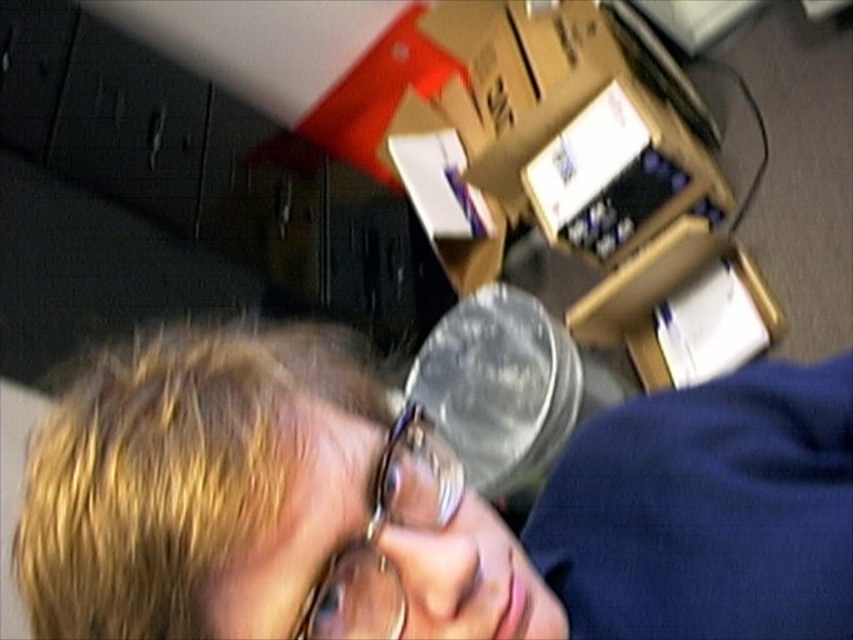
Is blonde hair at center shorter than gold-rimmed glasses at center?

Incorrect, blonde hair at center's height does not fall short of gold-rimmed glasses at center's.

Does blonde hair at center appear over gold-rimmed glasses at center?

Incorrect, blonde hair at center is not positioned above gold-rimmed glasses at center.

Between point (115, 378) and point (311, 636), which one is positioned in front?

Positioned in front is point (311, 636).

Find the location of a particular element. This screenshot has height=640, width=853. blonde hair at center is located at coordinates (171, 470).

Does clear plastic cup at center appear over blonde hair at center?

Yes.

Between clear plastic cup at center and blonde hair at center, which one has less height?

Standing shorter between the two is clear plastic cup at center.

Who is more forward, (438,492) or (169,576)?

Point (169,576)

Where is `clear plastic cup at center`? Image resolution: width=853 pixels, height=640 pixels. clear plastic cup at center is located at coordinates (422, 506).

Who is shorter, clear plastic cup at center or gold-rimmed glasses at center?

gold-rimmed glasses at center

Which is in front, point (206, 337) or point (440, 497)?

Point (440, 497)

This screenshot has width=853, height=640. I want to click on clear plastic cup at center, so click(422, 506).

Where is `clear plastic cup at center`? clear plastic cup at center is located at coordinates (422, 506).